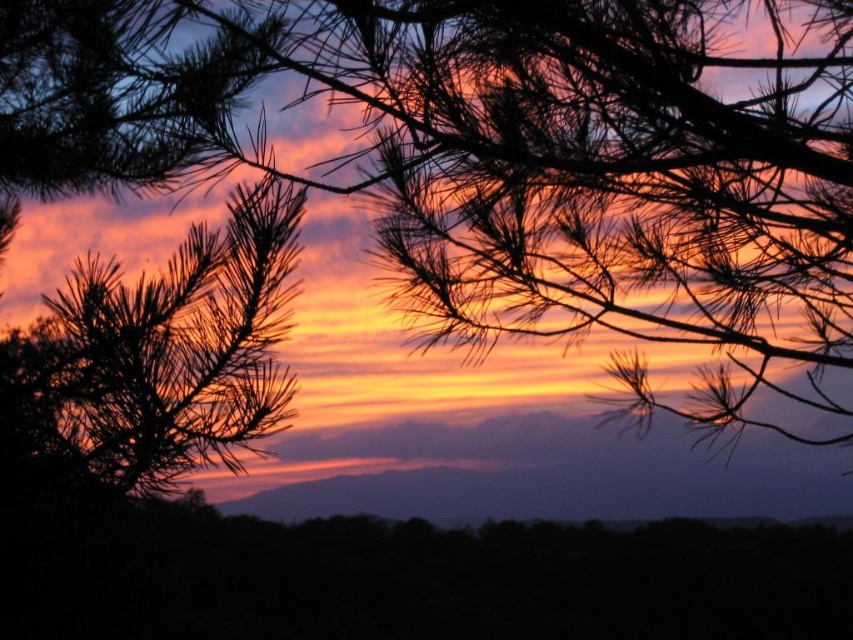
What do you see at coordinates (503, 157) in the screenshot? This screenshot has height=640, width=853. I see `silky dark green pine branches at upper center` at bounding box center [503, 157].

Is silky dark green pine branches at upper center smaller than silky brown pine branch at left?

Actually, silky dark green pine branches at upper center might be larger than silky brown pine branch at left.

Which is in front, point (811, 97) or point (115, 380)?

Point (115, 380) is in front.

Find the location of a particular element. The image size is (853, 640). silky dark green pine branches at upper center is located at coordinates (503, 157).